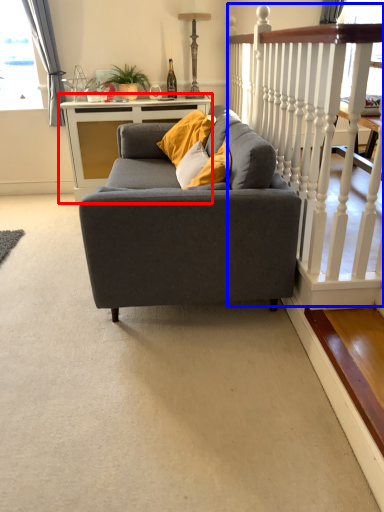
Question: Which point is further to the camera, table (highlighted by a red box) or rail (highlighted by a blue box)?

Choices:
 (A) table
 (B) rail

Answer: (A)